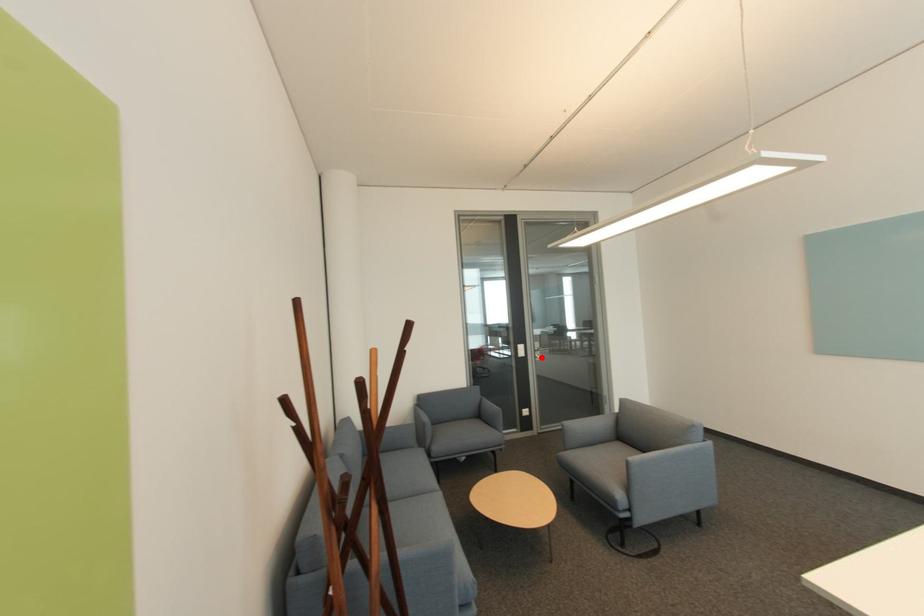
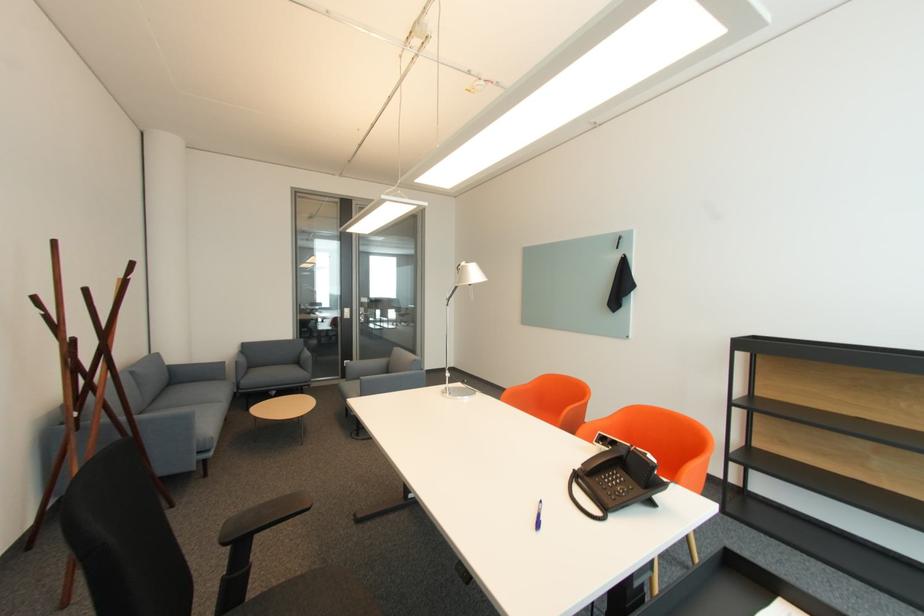
Question: I am providing you with two images of the same scene from different viewpoints. A red point is shown in image1. For the corresponding object point in image2, is it positioned nearer or farther from the camera?

Choices:
 (A) Nearer
 (B) Farther

Answer: (A)